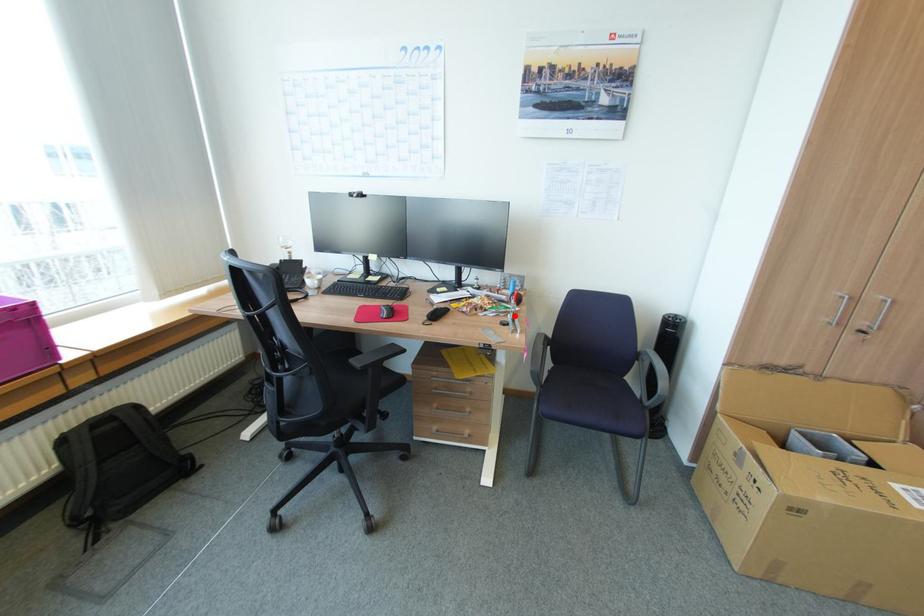
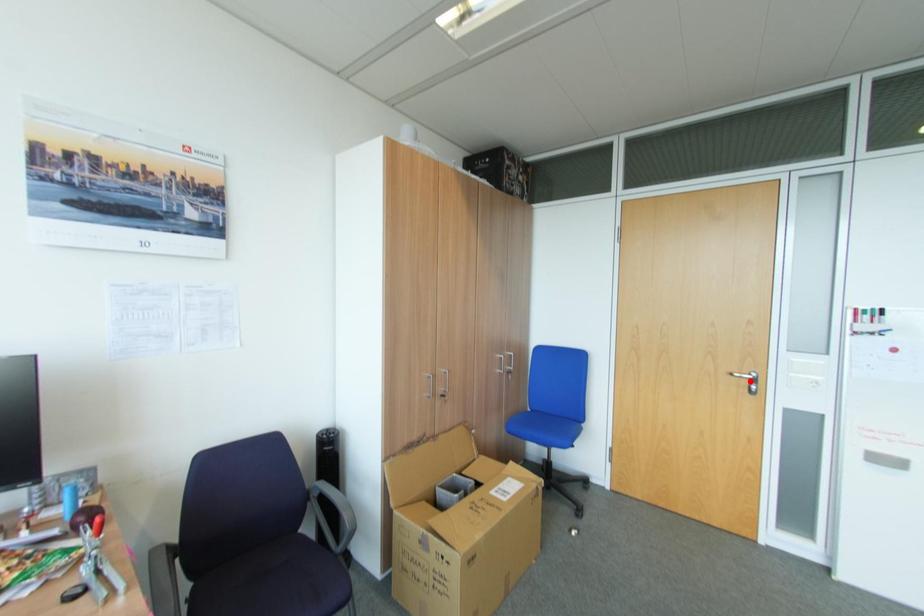
I am providing you with two images of the same scene from different viewpoints. A red point is marked on the first image and another point is marked on the second image. Does the point marked in image1 correspond to the same location as the one in image2?

No